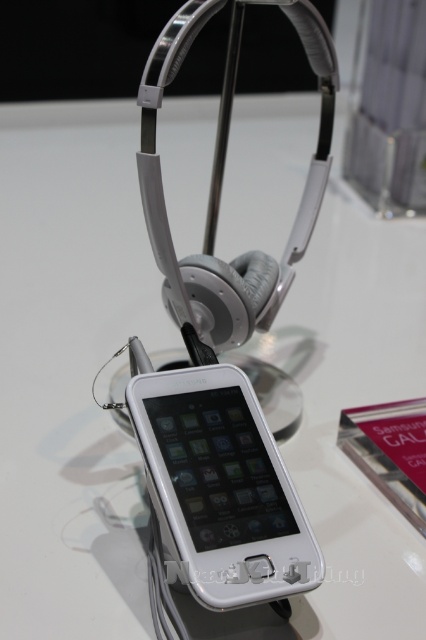
Which is more to the left, white glossy ipod at center or satin silver headphones at upper center?

From the viewer's perspective, white glossy ipod at center appears more on the left side.

From the picture: Is white glossy ipod at center wider than satin silver headphones at upper center?

No.

What do you see at coordinates (221, 486) in the screenshot? I see `white glossy ipod at center` at bounding box center [221, 486].

This screenshot has width=426, height=640. Find the location of `white glossy ipod at center`. white glossy ipod at center is located at coordinates (221, 486).